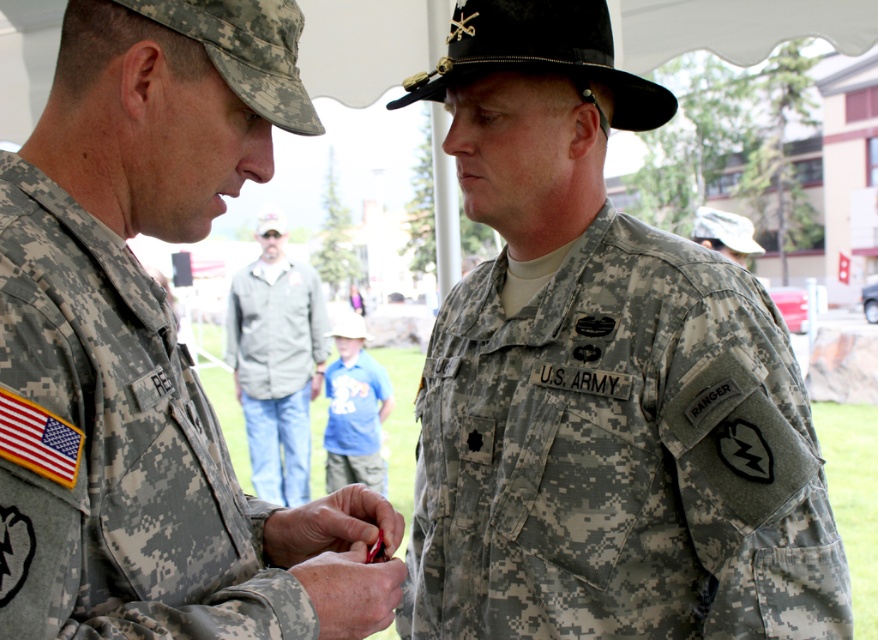
Question: Which point appears farthest from the camera in this image?

Choices:
 (A) (384, 401)
 (B) (759, 292)

Answer: (A)

Question: Which object is positioned closest to the gray fabric jacket at center?

Choices:
 (A) blue cotton shirt at center
 (B) camouflage fabric uniform at left
 (C) camouflage fabric us army uniform at center

Answer: (A)

Question: Can you confirm if camouflage fabric us army uniform at center is smaller than blue cotton shirt at center?

Choices:
 (A) no
 (B) yes

Answer: (B)

Question: Observing the image, what is the correct spatial positioning of camouflage fabric us army uniform at center in reference to camouflage fabric uniform at left?

Choices:
 (A) below
 (B) above

Answer: (A)

Question: Can you confirm if camouflage fabric us army uniform at center is positioned to the right of blue cotton shirt at center?

Choices:
 (A) no
 (B) yes

Answer: (B)

Question: Which point appears closest to the camera in this image?

Choices:
 (A) (6, 336)
 (B) (704, 420)
 (C) (335, 428)

Answer: (A)